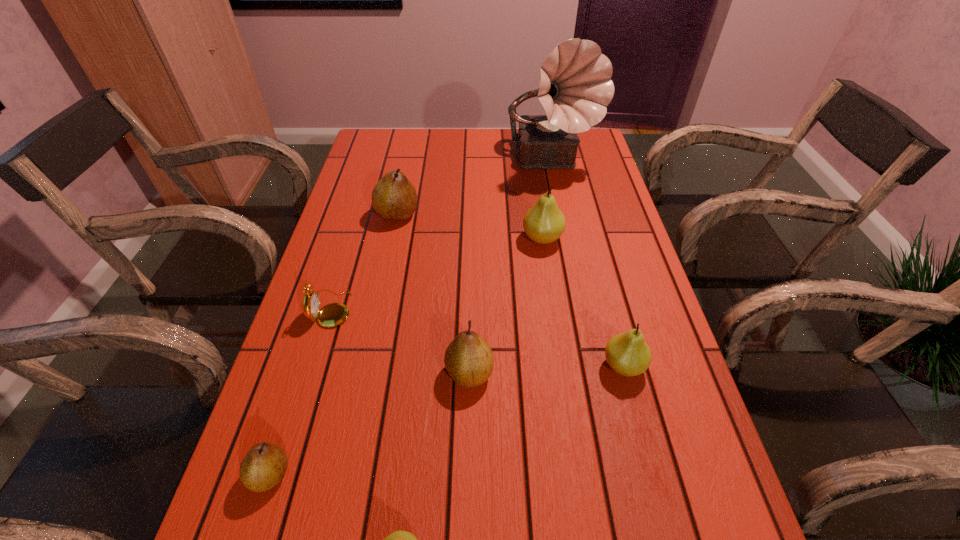
The image size is (960, 540). I want to click on vacant area that lies between the second nearest brown pear and the second green pear from left to right, so click(x=506, y=306).

I want to click on vacant space that's between the fourth farthest object and the seventh farthest object, so click(x=300, y=392).

I want to click on free space between the rightmost green pear and the smallest brown pear, so click(446, 420).

The width and height of the screenshot is (960, 540). I want to click on vacant area that lies between the pocket watch and the fifth pear from left to right, so click(437, 274).

Where is `free spot between the second brown pear from right to left and the fifth nearest object`? This screenshot has height=540, width=960. free spot between the second brown pear from right to left and the fifth nearest object is located at coordinates (364, 261).

The image size is (960, 540). I want to click on vacant area that lies between the second brown pear from left to right and the fourth object from right to left, so click(x=433, y=294).

Locate which object is the second closest to the farthest green pear. Please provide its 2D coordinates. Your answer should be formatted as a tuple, i.e. [(x, y)], where the tuple contains the x and y coordinates of a point satisfying the conditions above.

[(394, 198)]

You are a GUI agent. You are given a task and a screenshot of the screen. Output one action in this format:
    pyautogui.click(x=<x>, y=<y>)
    Task: Click on the fourth closest object to the rightmost green pear
    
    Given the screenshot: What is the action you would take?
    pyautogui.click(x=334, y=314)

Choose which pear is the fifth nearest neighbor to the second brown pear from left to right. Please provide its 2D coordinates. Your answer should be formatted as a tuple, i.e. [(x, y)], where the tuple contains the x and y coordinates of a point satisfying the conditions above.

[(399, 539)]

Point out which pear is positioned as the fourth nearest to the biggest brown pear. Please provide its 2D coordinates. Your answer should be formatted as a tuple, i.e. [(x, y)], where the tuple contains the x and y coordinates of a point satisfying the conditions above.

[(264, 466)]